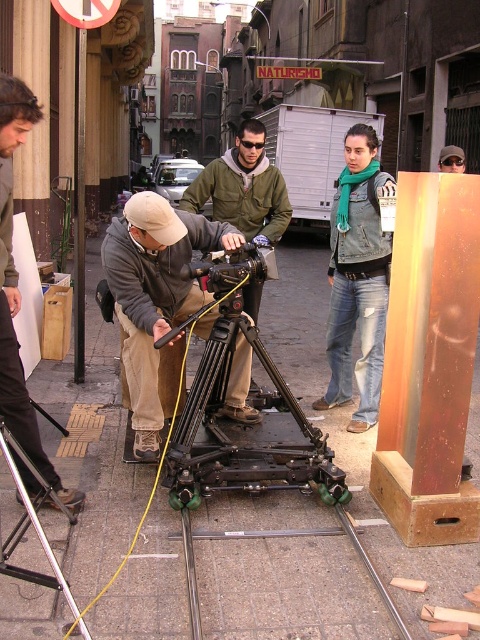
Who is more forward, (182, 513) or (63, 579)?

Positioned in front is point (63, 579).

Is metallic train track at center to the left of metallic silver tripod at lower left from the viewer's perspective?

Incorrect, metallic train track at center is not on the left side of metallic silver tripod at lower left.

Locate an element on the screen. This screenshot has width=480, height=640. metallic train track at center is located at coordinates (277, 538).

Between point (264, 241) and point (345, 528), which one is positioned in front?

Point (345, 528) is more forward.

Describe the element at coordinates (243, 188) in the screenshot. I see `green matte jacket at center` at that location.

Where is `green matte jacket at center`? The height and width of the screenshot is (640, 480). green matte jacket at center is located at coordinates (243, 188).

Can you confirm if khaki fabric hat at center is taller than metallic train track at center?

Indeed, khaki fabric hat at center has a greater height compared to metallic train track at center.

Is point (184, 253) farther from viewer compared to point (307, 534)?

Yes, point (184, 253) is farther from viewer.

Where is `khaki fabric hat at center`? The image size is (480, 640). khaki fabric hat at center is located at coordinates (156, 300).